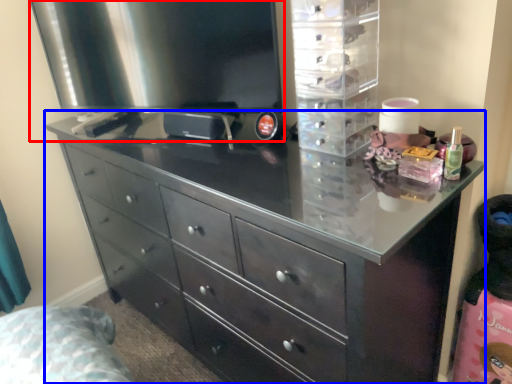
Question: Which point is closer to the camera, appliance (highlighted by a red box) or chest of drawers (highlighted by a blue box)?

Choices:
 (A) appliance
 (B) chest of drawers

Answer: (B)